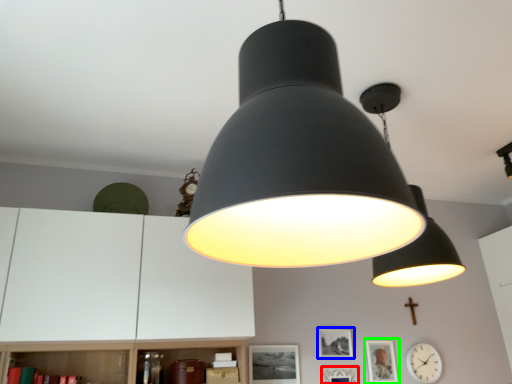
Question: Considering the real-world distances, which object is closest to picture frame (highlighted by a red box)? picture frame (highlighted by a blue box) or picture frame (highlighted by a green box).

Choices:
 (A) picture frame
 (B) picture frame

Answer: (A)